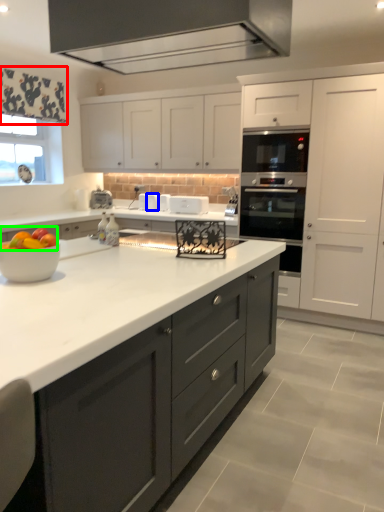
Question: Which is farther away from curtain (highlighted by a red box)? appliance (highlighted by a blue box) or fruit (highlighted by a green box)?

Choices:
 (A) appliance
 (B) fruit

Answer: (B)